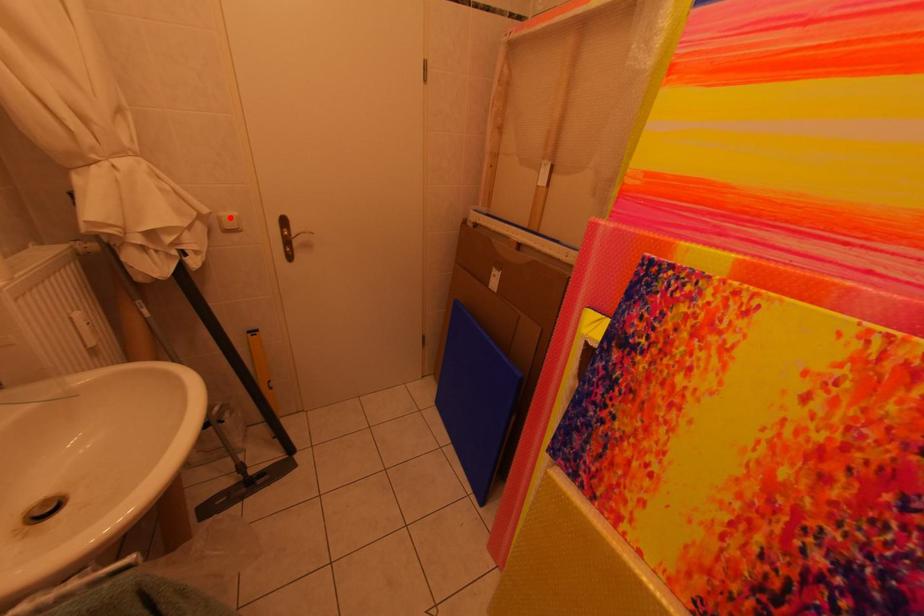
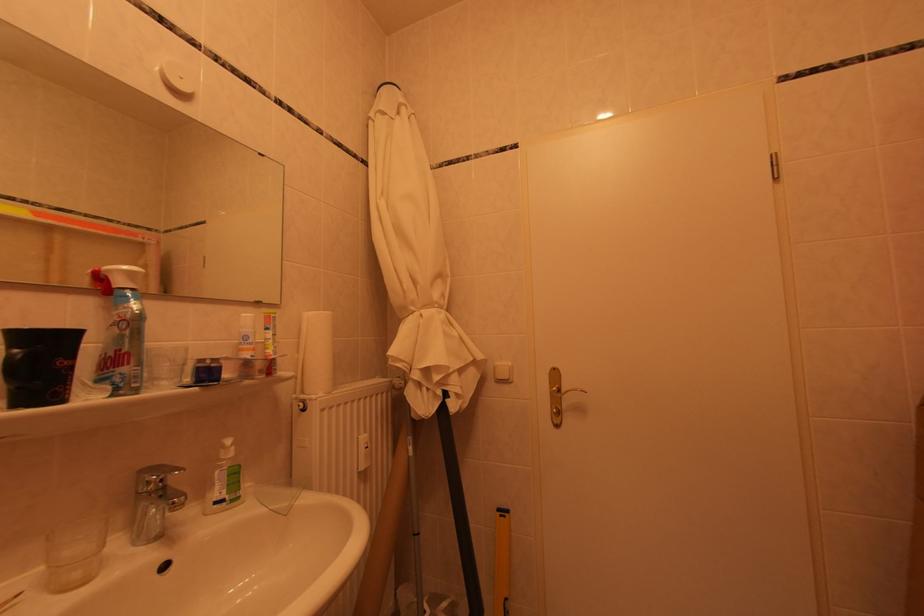
In the second image, find the point that corresponds to the highlighted location in the first image.

(506, 367)